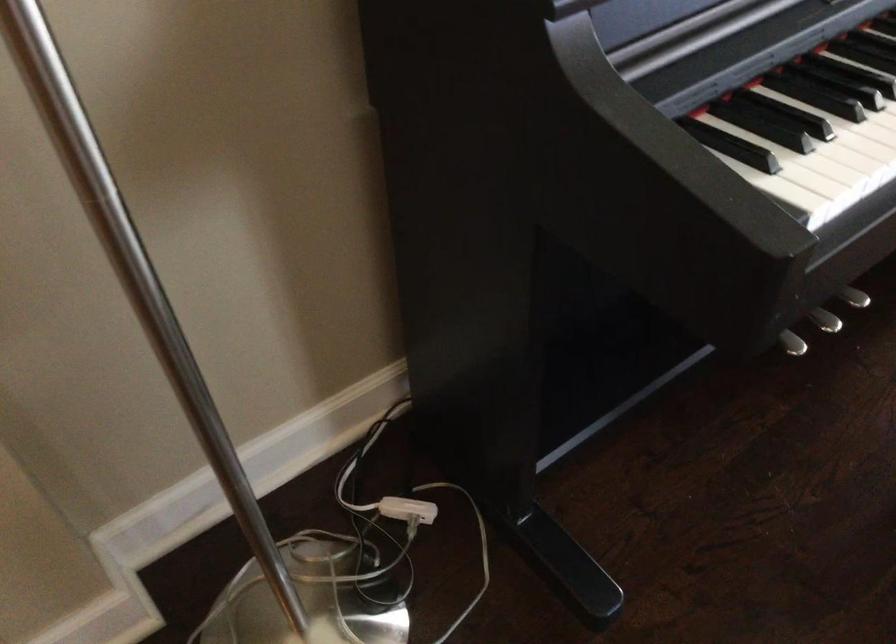
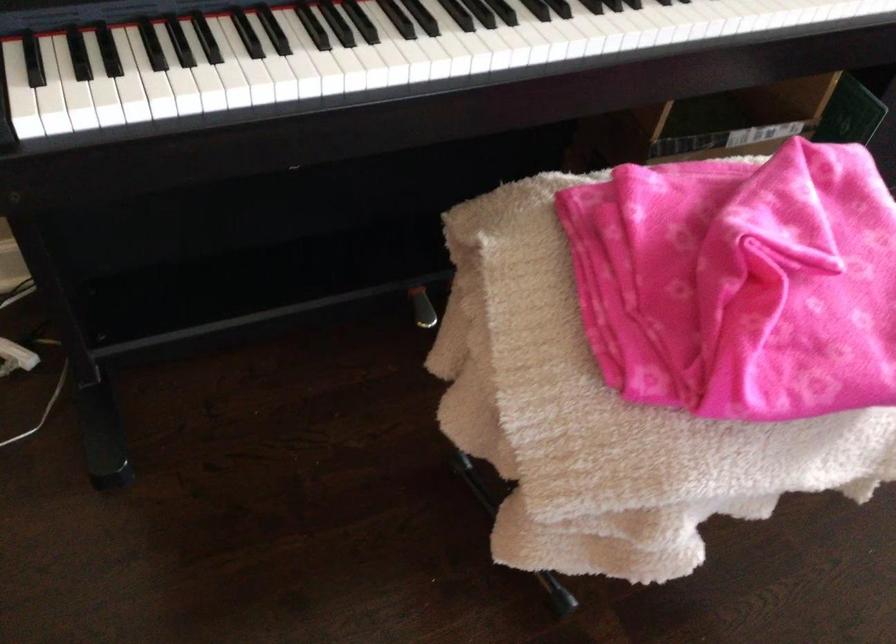
Question: I am providing you with two images of the same scene from different viewpoints. Which of the following objects are not visible in image2?

Choices:
 (A) silver piano pedal
 (B) piano keys
 (C) blue chair armrest
 (D) piano sustain pedal

Answer: (A)